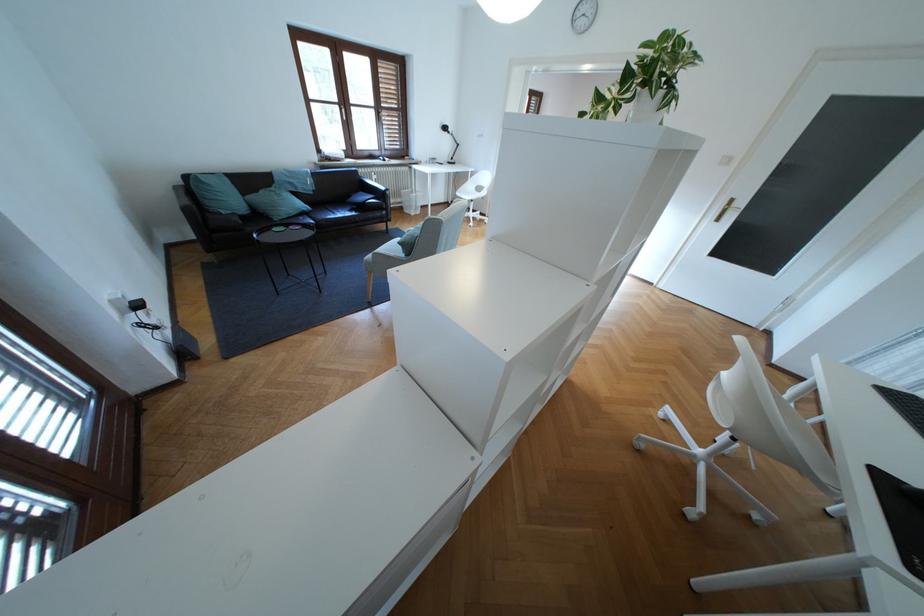
Locate an element on the screen. sofa armrest is located at coordinates (186, 198).